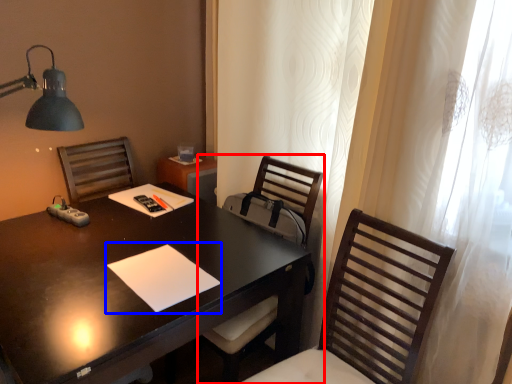
Question: Which point is closer to the camera, chair (highlighted by a red box) or notepad (highlighted by a blue box)?

Choices:
 (A) chair
 (B) notepad

Answer: (B)